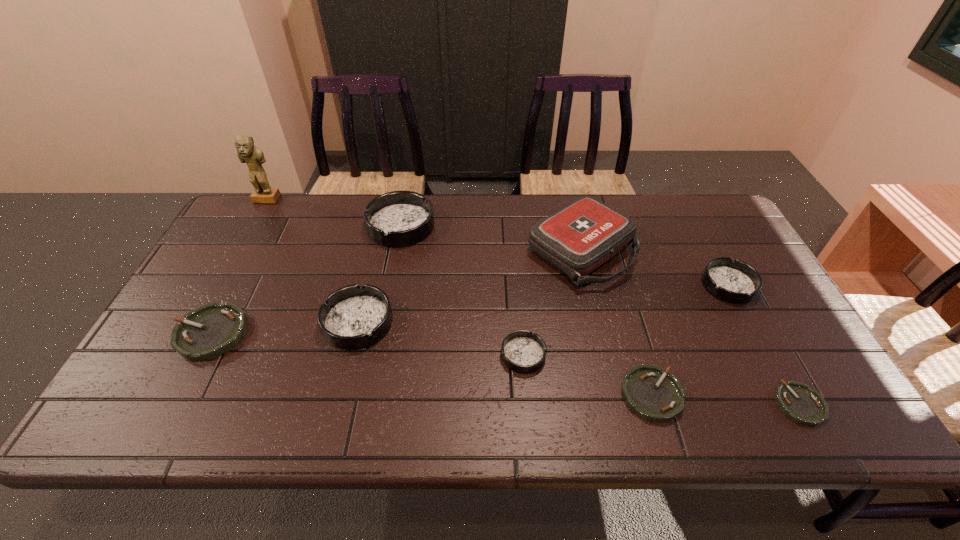
Locate an element on the screen. This screenshot has height=540, width=960. vacant area that lies between the farthest ashtray and the smallest green ashtray is located at coordinates (600, 315).

The width and height of the screenshot is (960, 540). I want to click on empty space between the first-aid kit and the fifth shortest ashtray, so click(x=655, y=268).

The image size is (960, 540). I want to click on blank region between the figurine and the leftmost ashtray, so click(x=239, y=267).

Locate an element on the screen. This screenshot has width=960, height=540. free area in between the first-aid kit and the second green ashtray from left to right is located at coordinates (616, 322).

At what (x,y) coordinates should I click in order to perform the action: click on empty space between the second tallest ashtray and the smallest dark ashtray. Please return your answer as a coordinate pair (x, y). The width and height of the screenshot is (960, 540). Looking at the image, I should click on (441, 339).

At what (x,y) coordinates should I click in order to perform the action: click on free spot between the first-aid kit and the sixth shortest ashtray. Please return your answer as a coordinate pair (x, y). The height and width of the screenshot is (540, 960). Looking at the image, I should click on (469, 286).

You are a GUI agent. You are given a task and a screenshot of the screen. Output one action in this format:
    pyautogui.click(x=<x>, y=<y>)
    Task: Click on the vacant space that is in between the second shortest ashtray and the red first-aid kit
    
    Given the screenshot: What is the action you would take?
    pyautogui.click(x=616, y=322)

Identify the location of object that ranks as the closest to the red first-aid kit. This screenshot has width=960, height=540. (522, 351).

Locate which object is the sixth closest to the shortest ashtray. Please provide its 2D coordinates. Your answer should be formatted as a tuple, i.e. [(x, y)], where the tuple contains the x and y coordinates of a point satisfying the conditions above.

[(399, 218)]

Choose which ashtray is the third nearest neighbor to the fifth shortest object. Please provide its 2D coordinates. Your answer should be formatted as a tuple, i.e. [(x, y)], where the tuple contains the x and y coordinates of a point satisfying the conditions above.

[(522, 351)]